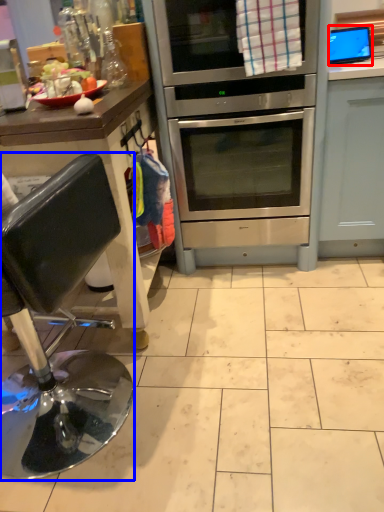
Question: Among these objects, which one is nearest to the camera, appliance (highlighted by a red box) or chair (highlighted by a blue box)?

Choices:
 (A) appliance
 (B) chair

Answer: (B)